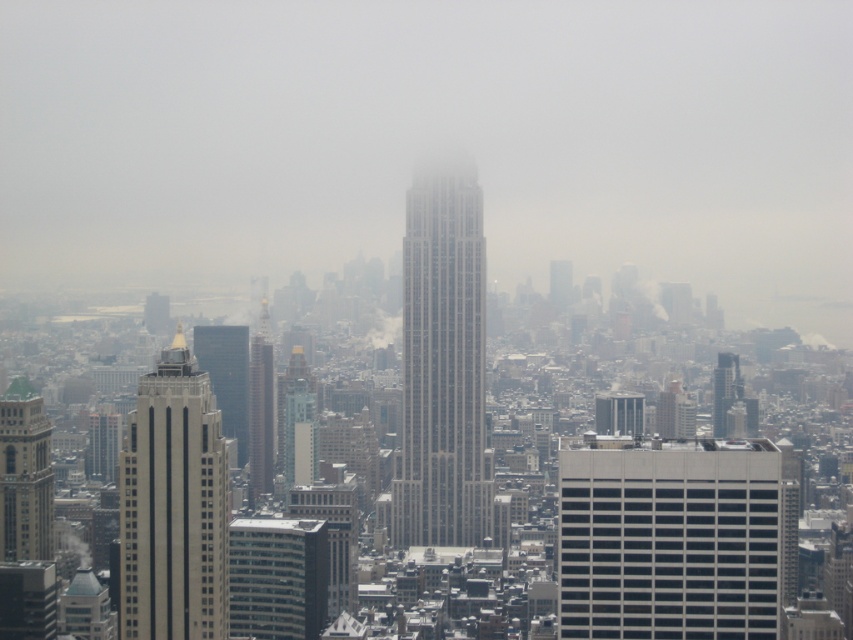
Question: Which is nearer to the gray glass skyscraper at center?

Choices:
 (A) dark gray glass skyscraper at center
 (B) gray stone skyscraper at center
 (C) glassy reflective skyscraper at left

Answer: (B)

Question: Is gray concrete building at center-right closer to camera compared to glassy reflective skyscraper at left?

Choices:
 (A) no
 (B) yes

Answer: (A)

Question: Which object is the closest to the dark gray glass skyscraper at center?

Choices:
 (A) gray concrete building at center-right
 (B) green marble tower at left
 (C) glassy reflective skyscraper at left

Answer: (C)

Question: Does dark gray glass skyscraper at center appear over light blue glass building at center?

Choices:
 (A) yes
 (B) no

Answer: (B)

Question: Is gray stone skyscraper at center smaller than smooth glass skyscraper at center?

Choices:
 (A) no
 (B) yes

Answer: (A)

Question: Based on their relative distances, which object is farther from the beige stone skyscraper at left?

Choices:
 (A) smooth glass skyscraper at center
 (B) gray glass skyscraper at center

Answer: (A)